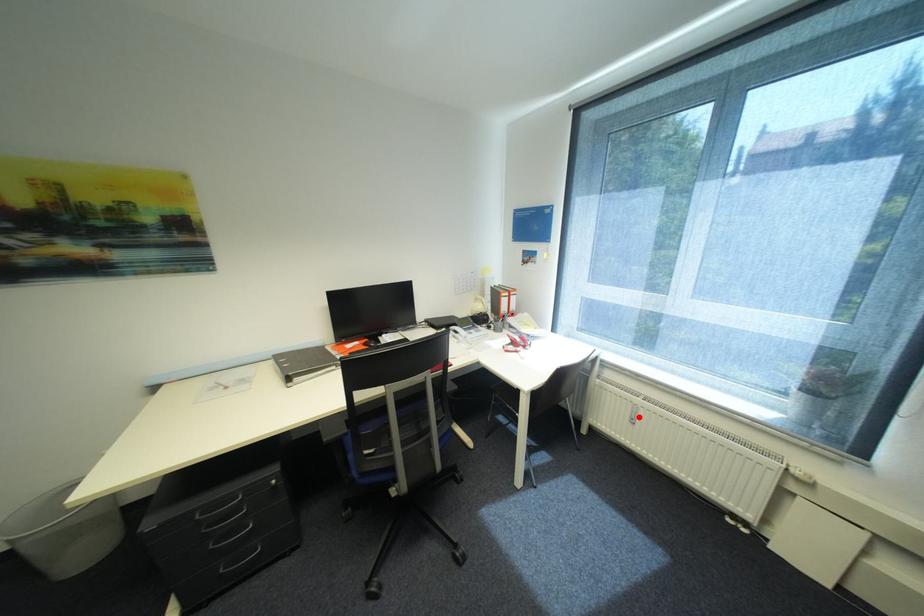
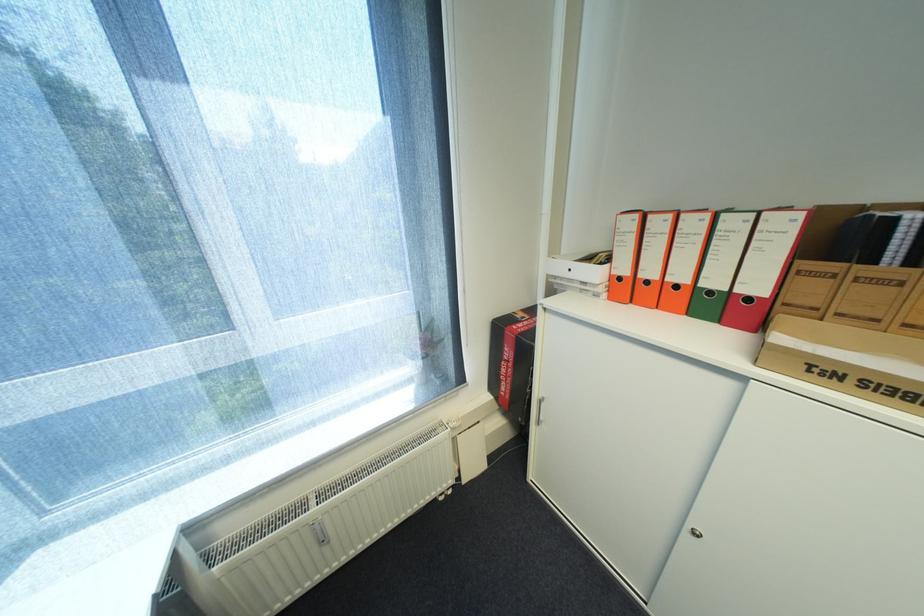
Question: I am providing you with two images of the same scene from different viewpoints. In image1, a red point is highlighted. Considering the same 3D point in image2, which of the following is correct?

Choices:
 (A) It is closer
 (B) It is farther

Answer: (A)